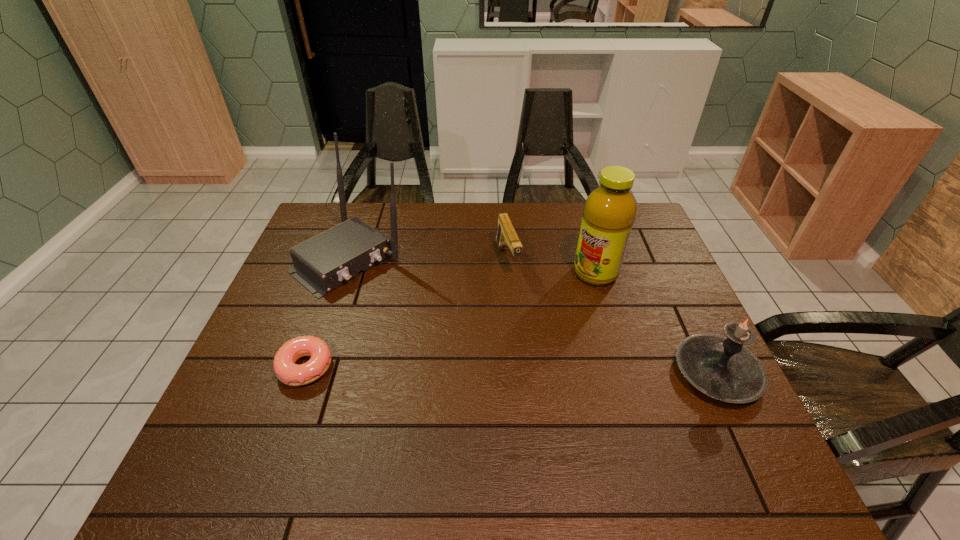
I want to click on the shortest object, so click(289, 373).

You are a GUI agent. You are given a task and a screenshot of the screen. Output one action in this format:
    pyautogui.click(x=<x>, y=<y>)
    Task: Click on the rightmost object
    
    Given the screenshot: What is the action you would take?
    pyautogui.click(x=722, y=368)

This screenshot has height=540, width=960. In order to click on candle in this screenshot , I will do `click(722, 368)`.

Locate an element on the screen. the fourth tallest object is located at coordinates (506, 235).

Where is `the third object from right to left`? This screenshot has height=540, width=960. the third object from right to left is located at coordinates (506, 235).

You are a GUI agent. You are given a task and a screenshot of the screen. Output one action in this format:
    pyautogui.click(x=<x>, y=<y>)
    Task: Click on the router
    
    Given the screenshot: What is the action you would take?
    pyautogui.click(x=322, y=263)

Locate an element on the screen. Image resolution: width=960 pixels, height=540 pixels. fruit juice is located at coordinates (609, 212).

What are the coordinates of `free location located on the right of the doughnut` in the screenshot? It's located at (438, 367).

Find the location of a particular element. The width and height of the screenshot is (960, 540). free space located 0.160m on the left of the third tallest object is located at coordinates (607, 373).

You are a GUI agent. You are given a task and a screenshot of the screen. Output one action in this format:
    pyautogui.click(x=<x>, y=<y>)
    Task: Click on the free location located 0.180m at the barrel of the second shortest object
    
    Given the screenshot: What is the action you would take?
    pyautogui.click(x=529, y=326)